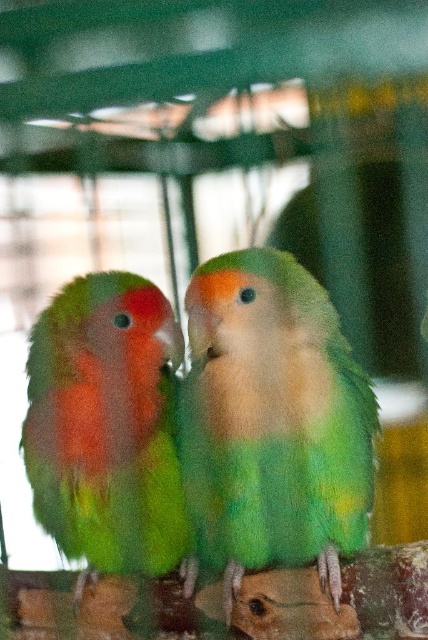
You are a bird enthusiast observing a green feathered parrot at center in a cage. If you want to place a treat exactly where the parrot is currently located, what coordinates should you aim for?

The green feathered parrot at center is located at coordinates point (273, 422), so you should aim for those coordinates to place the treat where the parrot is.

You are a bird keeper who needs to clean the birdcage. The green feathered parrot at center is currently perched at the center of the cage. If the cage is 6 feet wide, can you safely clean the area near the bars without getting too close to the bird?

The green feathered parrot at center is 4.57 feet away from the camera. Since the cage is 6 feet wide, there is enough space between the bird and the bars to safely clean the area near the bars without getting too close to the bird.

You are a bird enthusiast observing two parrots in a cage. You notice the green feathered parrot at center and the green matte parrot at left. Which parrot is positioned higher in the cage?

The green feathered parrot at center is positioned higher in the cage than the green matte parrot at left.